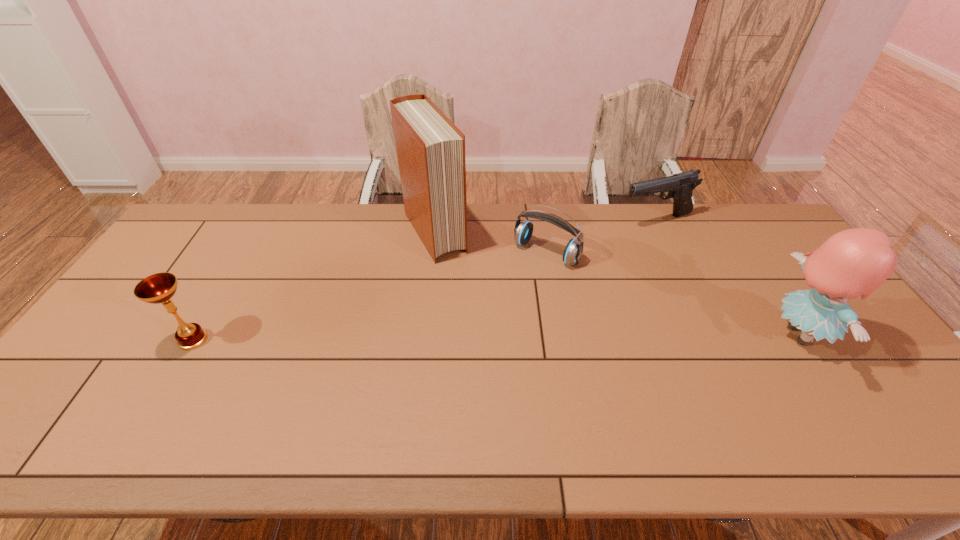
This screenshot has height=540, width=960. What are the coordinates of `free space on the desktop that is between the chalice and the fourth shortest object and is positioned on the ear cups of the third object from right to left` in the screenshot? It's located at (475, 338).

What are the coordinates of `free spot on the desktop that is between the chalice and the rightmost object and is positioned at the muzzle of the second object from right to left` in the screenshot? It's located at (582, 336).

Locate an element on the screen. vacant space on the desktop that is between the chalice and the rightmost object and is positioned on the open cover of the fourth object from right to left is located at coordinates 502,337.